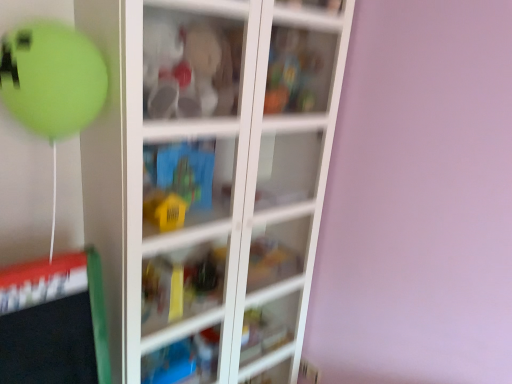
Question: Which direction should I rotate to look at transparent plastic cabinet at upper center, which appears as the first cabinet when viewed from the right, — up or down?

Choices:
 (A) down
 (B) up

Answer: (B)

Question: From a real-world perspective, is transparent plastic cabinet at upper center, marked as the second cabinet in a left-to-right arrangement, under blue plastic toy at center, the 1th cabinet in the left-to-right sequence?

Choices:
 (A) no
 (B) yes

Answer: (A)

Question: From a real-world perspective, is transparent plastic cabinet at upper center, arranged as the 1th cabinet when viewed from the top, on blue plastic toy at center, which is counted as the first cabinet, starting from the bottom?

Choices:
 (A) yes
 (B) no

Answer: (A)

Question: Can you confirm if transparent plastic cabinet at upper center, arranged as the 1th cabinet when viewed from the top, is thinner than blue plastic toy at center, the 2th cabinet viewed from the right?

Choices:
 (A) yes
 (B) no

Answer: (B)

Question: Would you consider transparent plastic cabinet at upper center, arranged as the second cabinet when ordered from the bottom, to be distant from blue plastic toy at center, the 1th cabinet in the left-to-right sequence?

Choices:
 (A) yes
 (B) no

Answer: (B)

Question: From the image's perspective, would you say transparent plastic cabinet at upper center, marked as the second cabinet in a left-to-right arrangement, is positioned over blue plastic toy at center, the 1th cabinet in the left-to-right sequence?

Choices:
 (A) no
 (B) yes

Answer: (B)

Question: Does transparent plastic cabinet at upper center, arranged as the 1th cabinet when viewed from the top, have a lesser height compared to blue plastic toy at center, which is counted as the second cabinet, starting from the top?

Choices:
 (A) no
 (B) yes

Answer: (A)

Question: From a real-world perspective, is blue plastic toy at center, which is counted as the first cabinet, starting from the bottom, physically below transparent glass cabinet at center?

Choices:
 (A) yes
 (B) no

Answer: (B)

Question: Can you confirm if blue plastic toy at center, the 2th cabinet viewed from the right, is smaller than transparent glass cabinet at center?

Choices:
 (A) yes
 (B) no

Answer: (A)

Question: Could transparent glass cabinet at center be considered to be inside blue plastic toy at center, the 1th cabinet in the left-to-right sequence?

Choices:
 (A) no
 (B) yes

Answer: (A)

Question: Is blue plastic toy at center, the 2th cabinet viewed from the right, shorter than transparent glass cabinet at center?

Choices:
 (A) no
 (B) yes

Answer: (B)

Question: Does blue plastic toy at center, the 2th cabinet viewed from the right, have a greater width compared to transparent glass cabinet at center?

Choices:
 (A) yes
 (B) no

Answer: (B)

Question: From the image's perspective, is blue plastic toy at center, the 2th cabinet viewed from the right, beneath transparent glass cabinet at center?

Choices:
 (A) no
 (B) yes

Answer: (A)

Question: Is blue plastic toy at center, the 1th cabinet in the left-to-right sequence, thinner than transparent plastic cabinet at upper center, arranged as the 1th cabinet when viewed from the top?

Choices:
 (A) no
 (B) yes

Answer: (B)